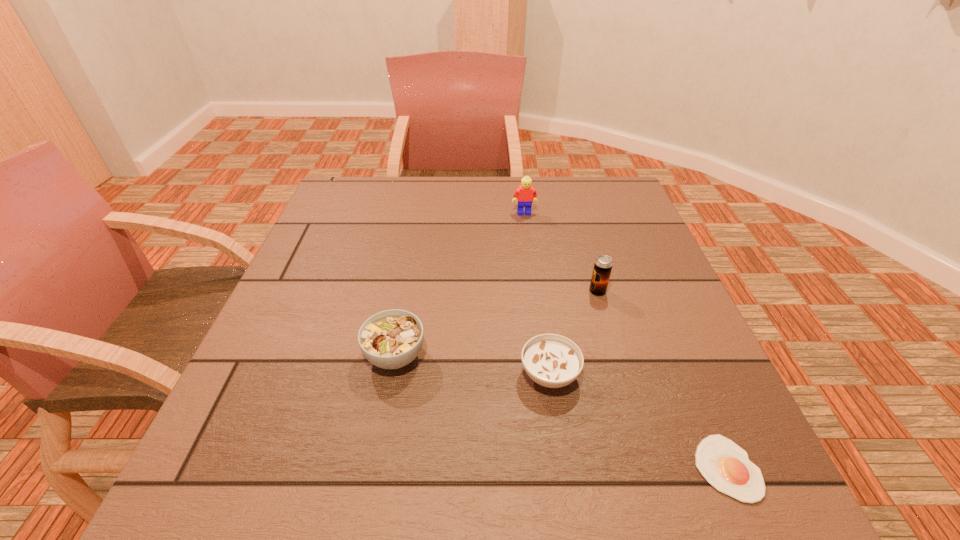
The image size is (960, 540). Identify the location of free point that satisfies the following two spatial constraints: 1. on the front-facing side of the farthest object; 2. on the right side of the egg yolk. (560, 468).

Locate an element on the screen. vacant point that satisfies the following two spatial constraints: 1. on the front-facing side of the farthest object; 2. on the right side of the egg yolk is located at coordinates (560, 468).

Where is `vacant space that satisfies the following two spatial constraints: 1. on the front-facing side of the Lego; 2. on the left side of the right soup bowl`? Image resolution: width=960 pixels, height=540 pixels. vacant space that satisfies the following two spatial constraints: 1. on the front-facing side of the Lego; 2. on the left side of the right soup bowl is located at coordinates (546, 374).

This screenshot has width=960, height=540. Identify the location of free space in the image that satisfies the following two spatial constraints: 1. on the front-facing side of the farthest object; 2. on the right side of the right soup bowl. (546, 374).